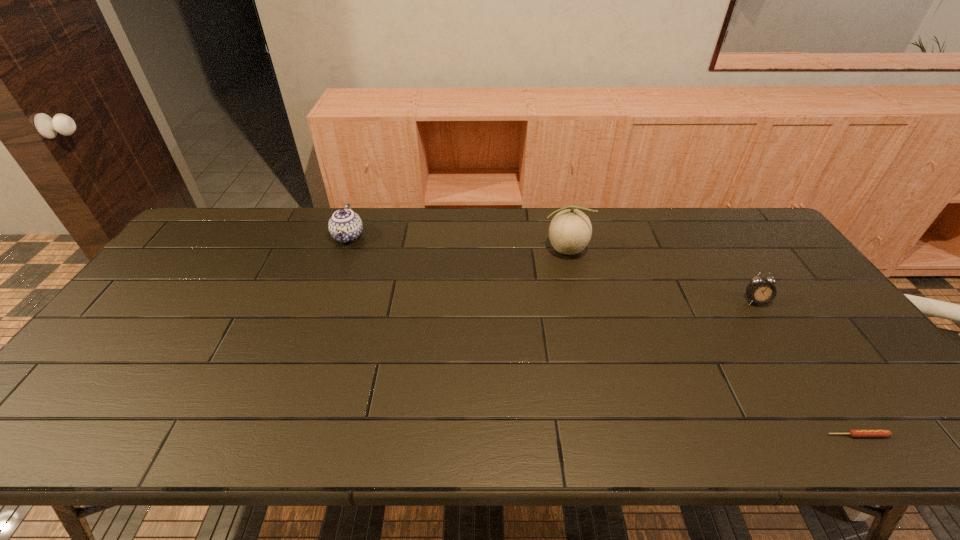
Where is `vacant space that's between the second nearest object and the second object from left to right`? vacant space that's between the second nearest object and the second object from left to right is located at coordinates (660, 275).

You are a GUI agent. You are given a task and a screenshot of the screen. Output one action in this format:
    pyautogui.click(x=<x>, y=<y>)
    Task: Click on the vacant region between the tallest object and the third farthest object
    The width and height of the screenshot is (960, 540).
    Given the screenshot: What is the action you would take?
    pyautogui.click(x=660, y=275)

Locate which object ranks third in proximity to the chinaware. Please provide its 2D coordinates. Your answer should be formatted as a tuple, i.e. [(x, y)], where the tuple contains the x and y coordinates of a point satisfying the conditions above.

[(856, 433)]

Image resolution: width=960 pixels, height=540 pixels. In order to click on object that can be found as the closest to the shortest object in this screenshot , I will do `click(759, 290)`.

Locate an element on the screen. free space in the image that satisfies the following two spatial constraints: 1. on the front side of the cantaloup; 2. on the right side of the sausage is located at coordinates (609, 435).

Locate an element on the screen. The image size is (960, 540). blank space that satisfies the following two spatial constraints: 1. from the spout of the leftmost object; 2. on the right side of the tallest object is located at coordinates (343, 250).

Where is `free spot that satisfies the following two spatial constraints: 1. on the face of the alarm clock; 2. on the right side of the shortest object`? free spot that satisfies the following two spatial constraints: 1. on the face of the alarm clock; 2. on the right side of the shortest object is located at coordinates (844, 435).

The width and height of the screenshot is (960, 540). In order to click on free space that satisfies the following two spatial constraints: 1. from the spout of the chinaware; 2. on the left side of the shortest object in this screenshot , I will do `click(275, 435)`.

I want to click on free location that satisfies the following two spatial constraints: 1. from the spout of the leftmost object; 2. on the right side of the cantaloup, so click(x=343, y=250).

This screenshot has width=960, height=540. In order to click on free location that satisfies the following two spatial constraints: 1. from the spout of the third shortest object; 2. on the left side of the second object from left to right in this screenshot , I will do `click(343, 250)`.